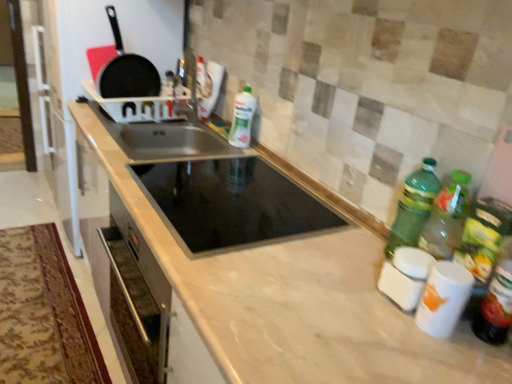
Question: Choose the correct answer: Is white glossy bottle at center, positioned as the third bottle in right-to-left order, inside black glass sink at center, the 2th sink in the back-to-front sequence, or outside it?

Choices:
 (A) inside
 (B) outside

Answer: (B)

Question: Does point (250, 94) appear closer or farther from the camera than point (189, 198)?

Choices:
 (A) closer
 (B) farther

Answer: (B)

Question: Estimate the real-world distances between objects in this image. Which object is closer to the black glass sink at center, the 2th sink in the back-to-front sequence?

Choices:
 (A) green plastic bottle at right, the 3th bottle in the back-to-front sequence
 (B) matte black frying pan at upper left
 (C) stainless steel sink at center, which appears as the 2th sink when viewed from the front
 (D) white glossy canisters at lower right
 (E) marble countertop at center

Answer: (C)

Question: Which is farther from the black glass sink at center, the 1th sink viewed from the front?

Choices:
 (A) green plastic bottle at right, which is counted as the 3th bottle, starting from the left
 (B) marble countertop at center
 (C) white glossy bottle at center, the third bottle in the front-to-back sequence
 (D) green plastic bottle at right, the 2th bottle when ordered from left to right
 (E) stainless steel sink at center, the first sink positioned from the back

Answer: (A)